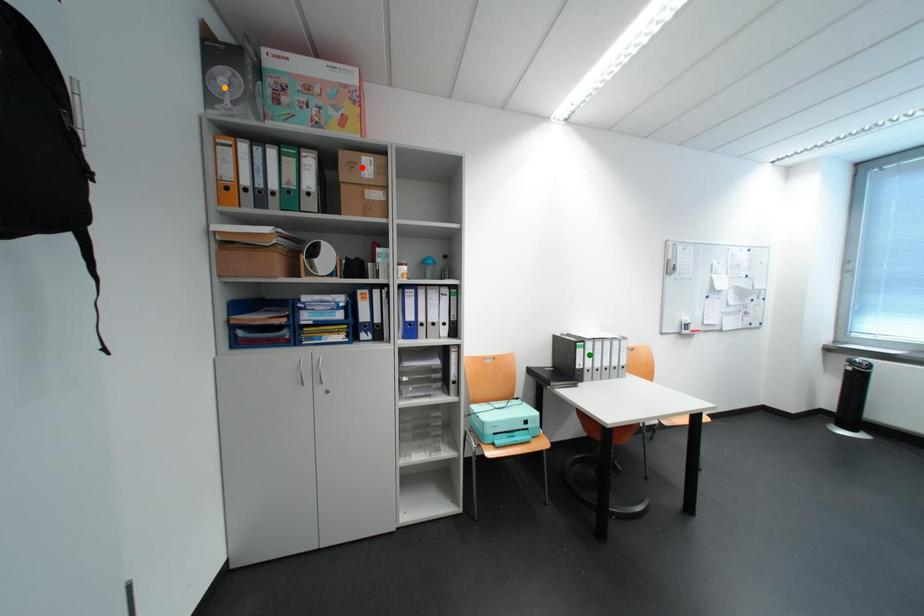
Order these from nearest to farthest:
green point
orange point
red point

orange point
red point
green point